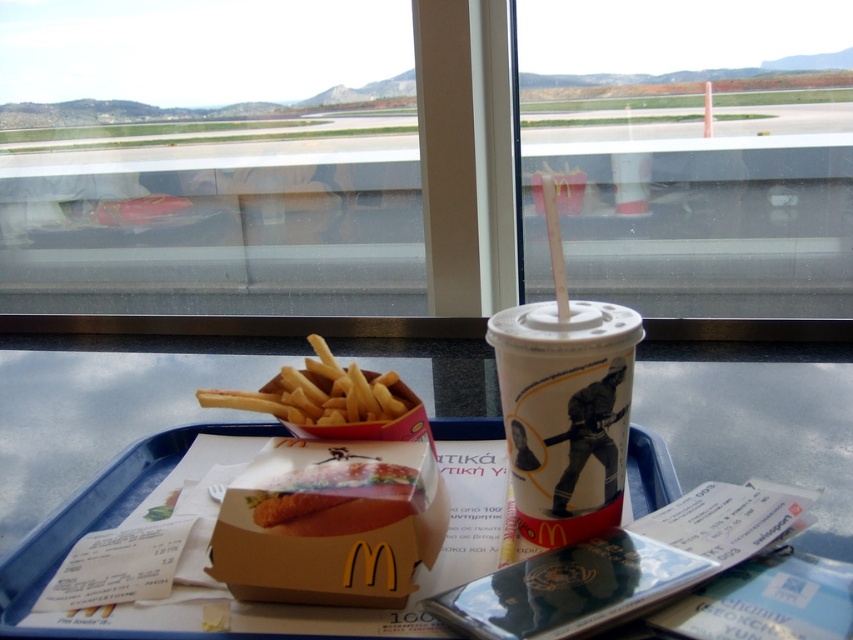
Question: Among these points, which one is farthest from the camera?

Choices:
 (A) (325, 12)
 (B) (581, 408)

Answer: (A)

Question: Among these points, which one is farthest from the camera?

Choices:
 (A) (811, 42)
 (B) (351, 419)

Answer: (A)

Question: Among these points, which one is nearest to the camera?

Choices:
 (A) (276, 522)
 (B) (221, 4)
 (C) (645, 124)

Answer: (A)

Question: Where is blue plastic tray at center located in relation to cardboard box at center in the image?

Choices:
 (A) left
 (B) right

Answer: (A)

Question: Is transparent plastic cup at center below blue plastic tray at center?

Choices:
 (A) no
 (B) yes

Answer: (A)

Question: Is transparent plastic cup at center further to camera compared to blue plastic tray at center?

Choices:
 (A) no
 (B) yes

Answer: (B)